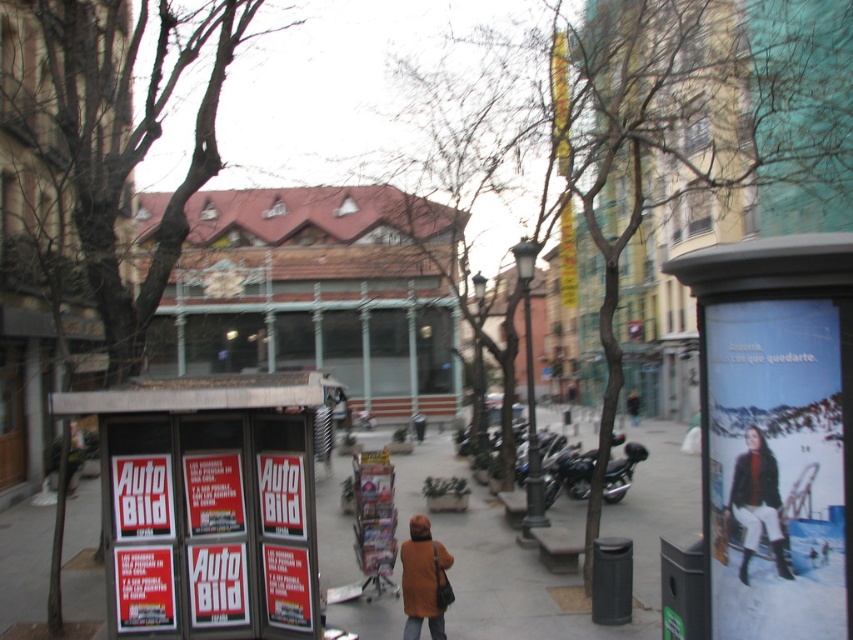
You are a delivery person trying to deliver a package to the brown wooden building at center. You are currently standing next to the orange woolen coat at lower center. Can you walk straight ahead to reach the building without needing to go around any obstacles?

The brown wooden building at center is further to the viewer than the orange woolen coat at lower center, meaning it is closer to you. Since the building is closer, you can walk straight ahead towards it without needing to go around obstacles.